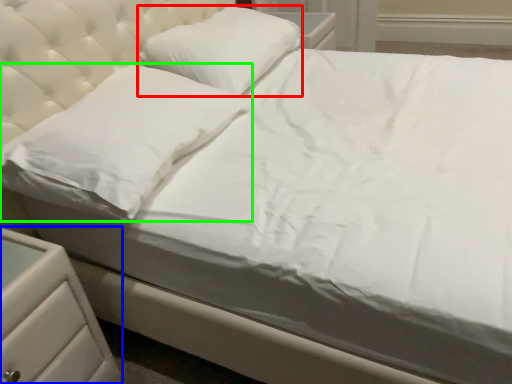
Question: Which object is the farthest from pillow (highlighted by a red box)? Choose among these: nightstand (highlighted by a blue box) or pillow (highlighted by a green box).

Choices:
 (A) nightstand
 (B) pillow

Answer: (A)